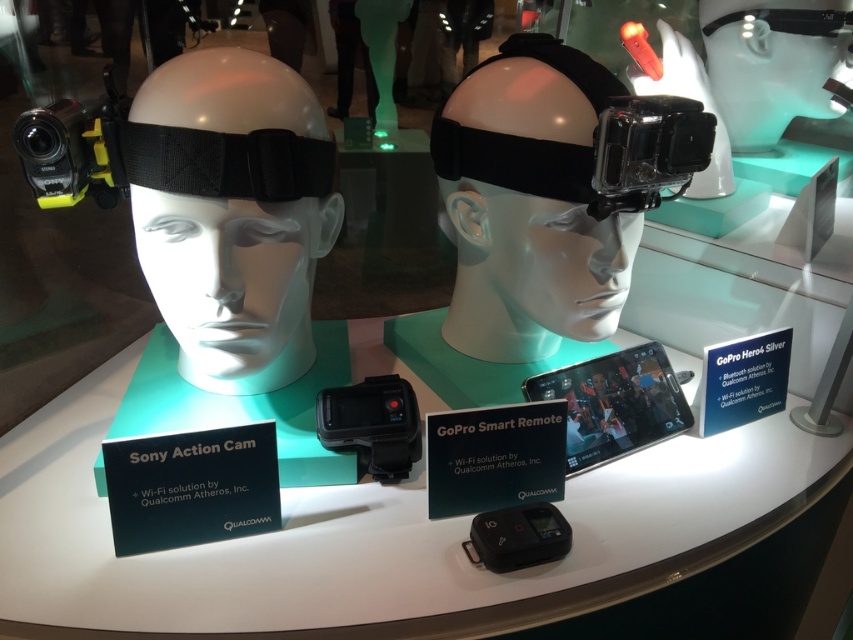
Question: Can you confirm if black matte gopro at center is positioned below matte black headband at center?

Choices:
 (A) no
 (B) yes

Answer: (A)

Question: Estimate the real-world distances between objects in this image. Which object is closer to the black matte gopro at center?

Choices:
 (A) matte black headband at center
 (B) white glossy table at center

Answer: (A)

Question: Can you confirm if white glossy table at center is positioned below black matte gopro at center?

Choices:
 (A) yes
 (B) no

Answer: (A)

Question: Among these objects, which one is farthest from the camera?

Choices:
 (A) black matte gopro at center
 (B) matte black headband at center

Answer: (A)

Question: Which of the following is the closest to the observer?

Choices:
 (A) white glossy table at center
 (B) matte black headband at center

Answer: (A)

Question: Does white glossy table at center have a lesser width compared to black matte gopro at center?

Choices:
 (A) no
 (B) yes

Answer: (A)